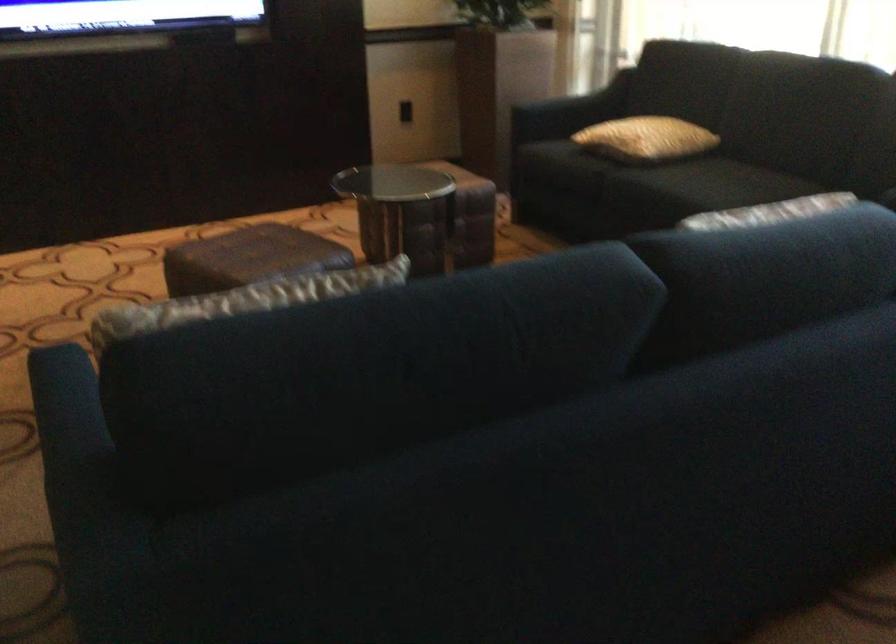
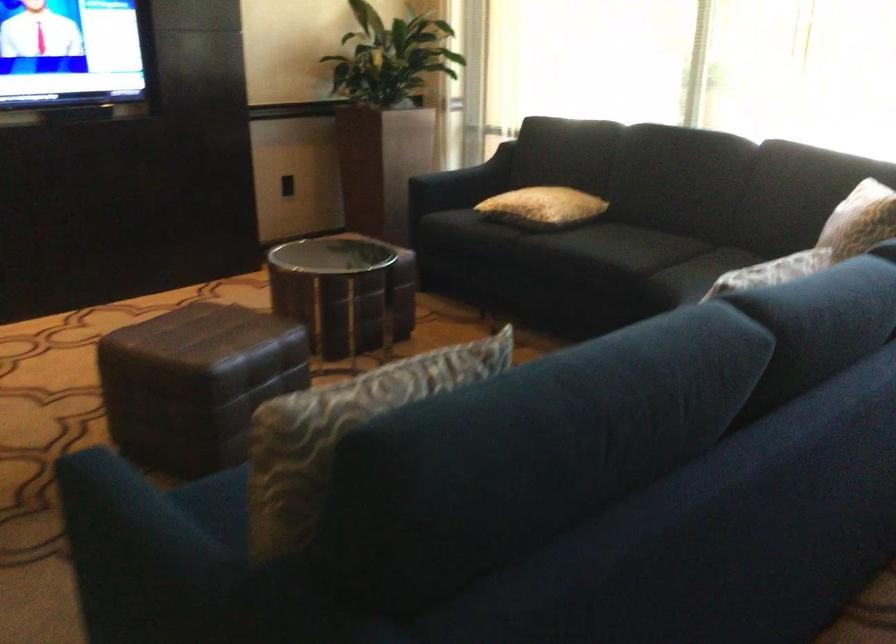
The point at (188,357) is marked in the first image. Where is the corresponding point in the second image?

(340, 431)